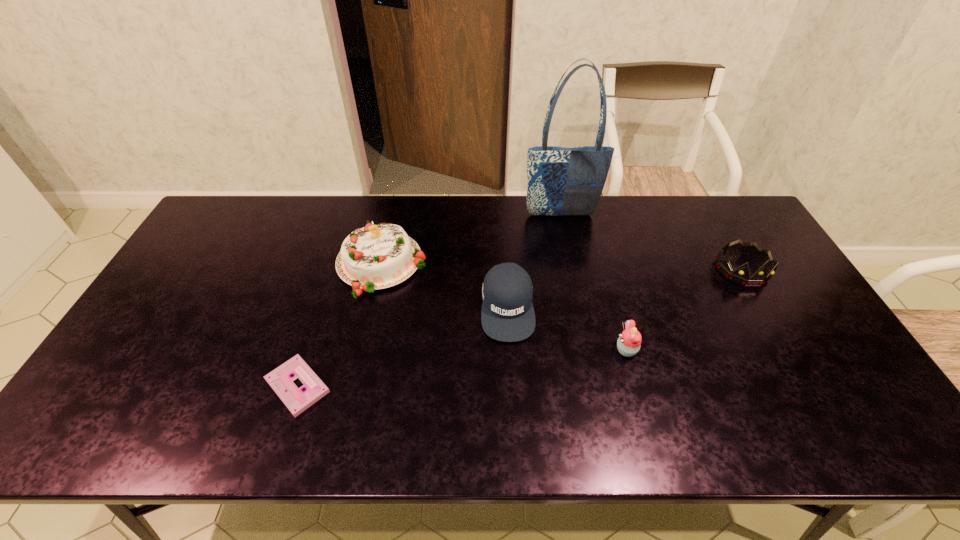
In order to click on shopping bag in this screenshot , I will do pyautogui.click(x=562, y=181).

Image resolution: width=960 pixels, height=540 pixels. I want to click on the farthest object, so click(562, 181).

Find the location of `cake`. cake is located at coordinates [380, 256].

Where is `tiara`? The image size is (960, 540). tiara is located at coordinates (x=740, y=275).

Locate an element on the screen. baseball cap is located at coordinates (507, 315).

Image resolution: width=960 pixels, height=540 pixels. I want to click on cupcake, so click(x=628, y=344).

Where is `the shortest object`? This screenshot has width=960, height=540. the shortest object is located at coordinates (281, 379).

Where is `free region located 0.120m on the front-facing side of the shopping bag`? The image size is (960, 540). free region located 0.120m on the front-facing side of the shopping bag is located at coordinates (566, 243).

Where is `vacant space situated on the right of the cake`? Image resolution: width=960 pixels, height=540 pixels. vacant space situated on the right of the cake is located at coordinates (484, 265).

You are a GUI agent. You are given a task and a screenshot of the screen. Output one action in this format:
    pyautogui.click(x=<x>, y=<y>)
    Task: Click on the free space located at the front of the tiara with jewels
    
    Given the screenshot: What is the action you would take?
    pyautogui.click(x=804, y=378)